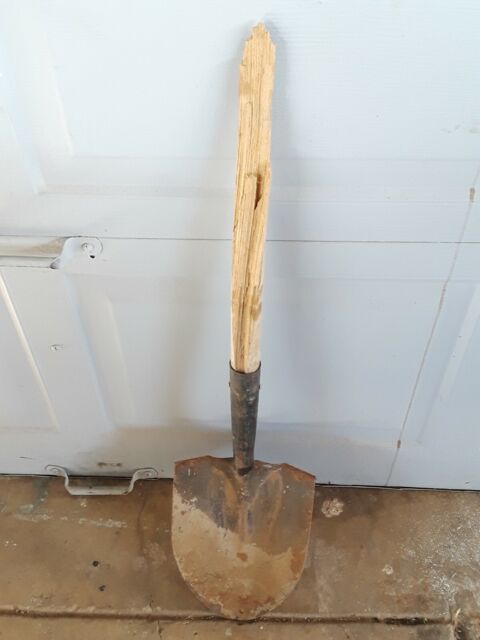
Locate an element on the screen. Image resolution: width=480 pixels, height=640 pixels. crack in floor is located at coordinates (128, 617).